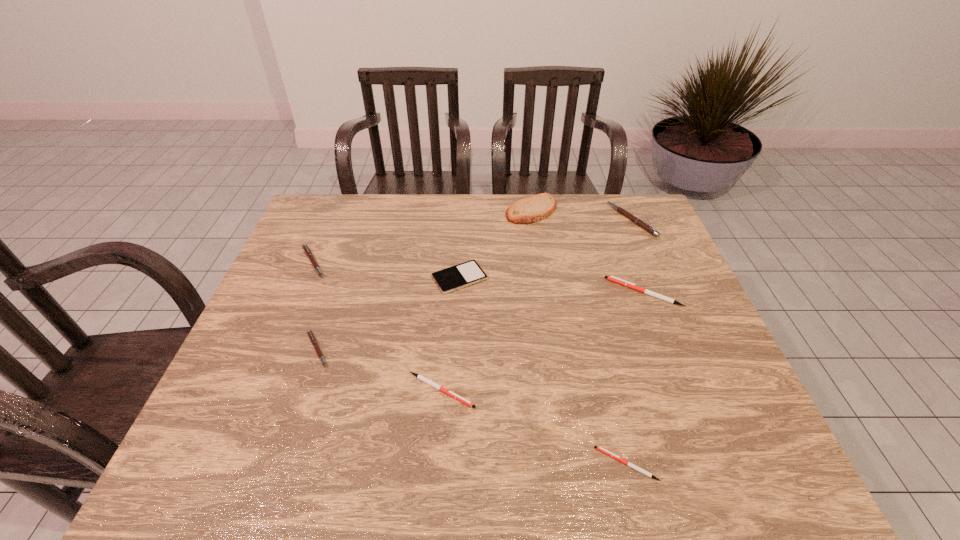
Image resolution: width=960 pixels, height=540 pixels. Find the location of `object present at the near edge`. object present at the near edge is located at coordinates (601, 449).

The height and width of the screenshot is (540, 960). Find the location of `object situated at the far right corner`. object situated at the far right corner is located at coordinates (639, 222).

Where is `free location at the far edge of the desktop`? The width and height of the screenshot is (960, 540). free location at the far edge of the desktop is located at coordinates (378, 201).

The image size is (960, 540). I want to click on vacant space at the near edge, so click(381, 478).

This screenshot has width=960, height=540. Identify the location of blank area at the left edge. (267, 333).

Identify the location of vacant area at the far left corner of the desktop. This screenshot has width=960, height=540. (302, 229).

In the image, there is a desktop. Where is `free region at the near right corner`? Image resolution: width=960 pixels, height=540 pixels. free region at the near right corner is located at coordinates (716, 472).

Where is `free space between the second nearest object and the tallest object`? Image resolution: width=960 pixels, height=540 pixels. free space between the second nearest object and the tallest object is located at coordinates (487, 300).

The height and width of the screenshot is (540, 960). Identify the location of free point between the seventh farthest object and the iPod. (450, 334).

Find the location of a particular element. vacant space in between the tallest object and the third nearest pen is located at coordinates (424, 280).